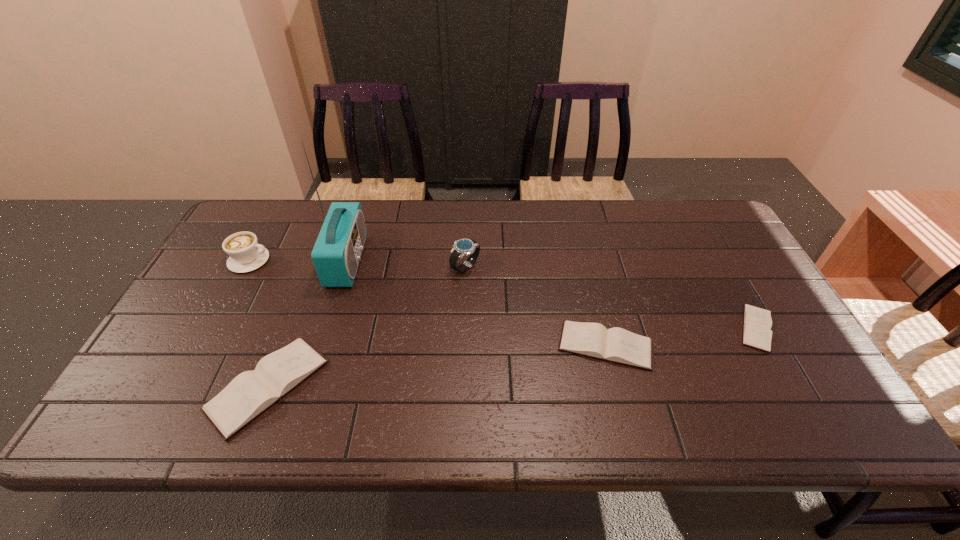
At what (x,y) coordinates should I click in order to perform the action: click on free space between the third tallest object and the second diary from left to right. Please return your answer as a coordinate pair (x, y). This screenshot has width=960, height=540. Looking at the image, I should click on (427, 303).

Where is `free spot between the fifth tallest object and the fourth shortest object`? The width and height of the screenshot is (960, 540). free spot between the fifth tallest object and the fourth shortest object is located at coordinates [427, 303].

This screenshot has height=540, width=960. In order to click on vacant point located between the leftmost object and the tallest object in this screenshot , I will do `click(299, 260)`.

At what (x,y) coordinates should I click in order to perform the action: click on free spot between the rightmost diary and the leftmost diary. Please return your answer as a coordinate pair (x, y). The image size is (960, 540). Looking at the image, I should click on (512, 357).

Locate an element on the screen. Image resolution: width=960 pixels, height=540 pixels. the closest object to the tallest object is located at coordinates (248, 395).

Locate which object is the second closest to the second object from right to left. Please provide its 2D coordinates. Your answer should be formatted as a tuple, i.e. [(x, y)], where the tuple contains the x and y coordinates of a point satisfying the conditions above.

[(463, 247)]

Where is `the third closest diary relative to the fourth shortest object`? The image size is (960, 540). the third closest diary relative to the fourth shortest object is located at coordinates (757, 322).

Identify the location of the second closest diary relative to the second diary from left to right. (248, 395).

Where is `vacant space that satisfies the following two spatial constraints: 1. to the right of the fourth shortest object's handle; 2. on the left side of the second tallest diary`? vacant space that satisfies the following two spatial constraints: 1. to the right of the fourth shortest object's handle; 2. on the left side of the second tallest diary is located at coordinates (204, 346).

You are a GUI agent. You are given a task and a screenshot of the screen. Output one action in this format:
    pyautogui.click(x=<x>, y=<y>)
    Task: Click on the free space that satisfies the following two spatial constraints: 1. on the back side of the second shortest object; 2. on the front panel of the tallest object
    Image resolution: width=960 pixels, height=540 pixels.
    Given the screenshot: What is the action you would take?
    pyautogui.click(x=585, y=261)